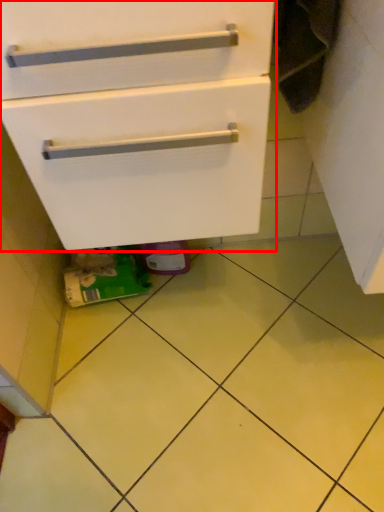
Question: From the image's perspective, what is the correct spatial relationship of cabinetry (annotated by the red box) in relation to ceramic tile?

Choices:
 (A) above
 (B) below

Answer: (A)